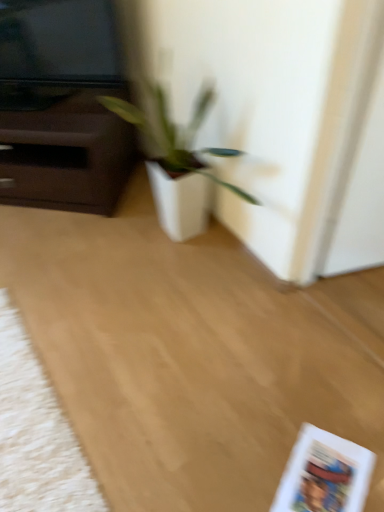
Identify the location of free area below white fluffy mat at lower left (from a real-world perspective). The width and height of the screenshot is (384, 512). (33, 413).